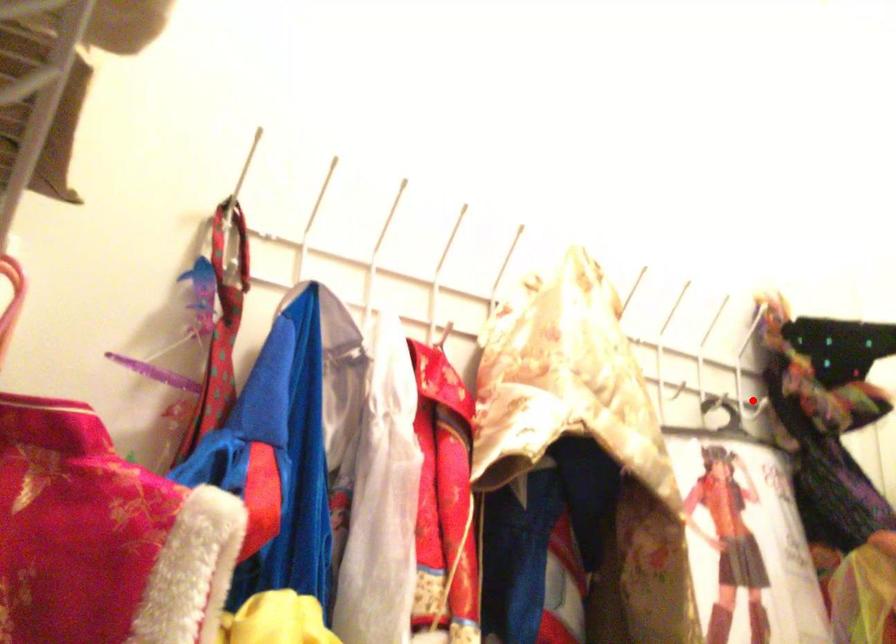
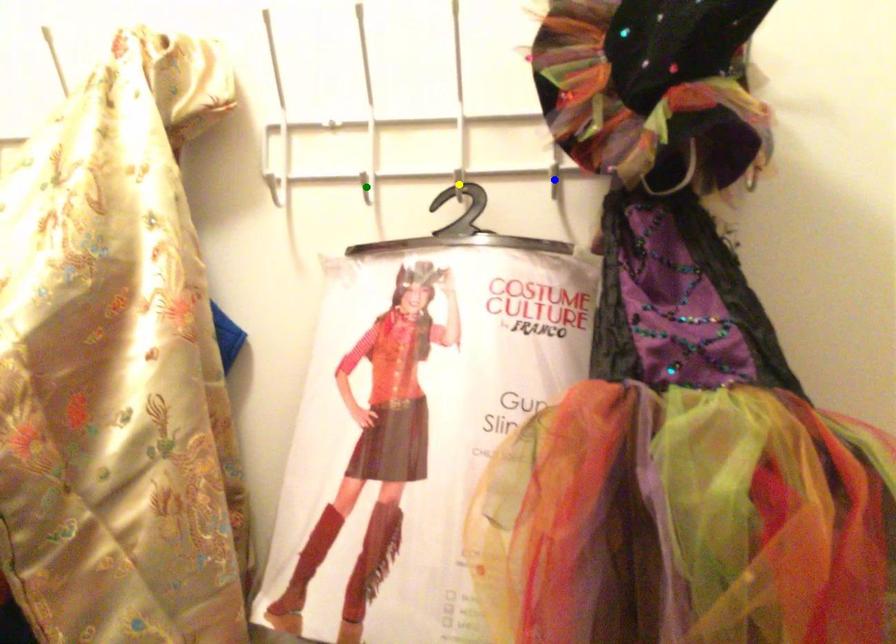
Question: I am providing you with two images of the same scene from different viewpoints. A red point is marked on the first image. You are given multiple points on the second image. Can you choose the point in image 2 that corresponds to the point in image 1?

Choices:
 (A) blue point
 (B) green point
 (C) yellow point

Answer: (A)